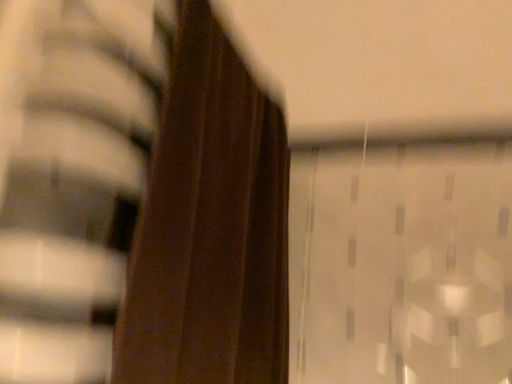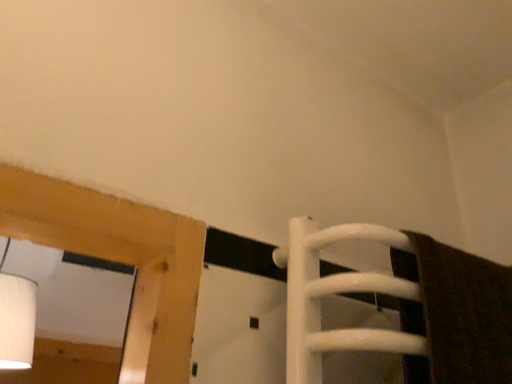
Question: Which way did the camera rotate in the video?

Choices:
 (A) rotated left
 (B) rotated right

Answer: (A)